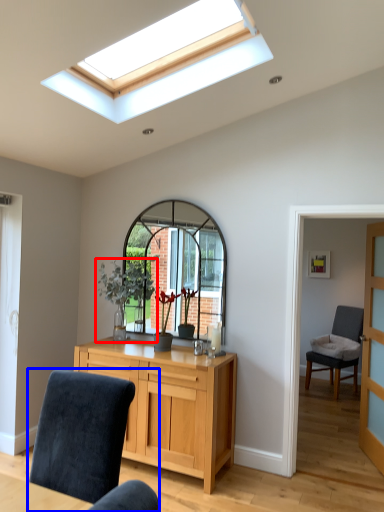
Question: Which point is closer to the camera, houseplant (highlighted by a red box) or chair (highlighted by a blue box)?

Choices:
 (A) houseplant
 (B) chair

Answer: (B)